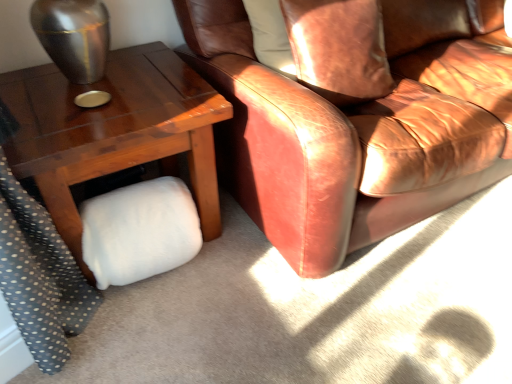
Identify the location of spots to the right of white fluffy pillow at lower left. Image resolution: width=512 pixels, height=384 pixels. (233, 269).